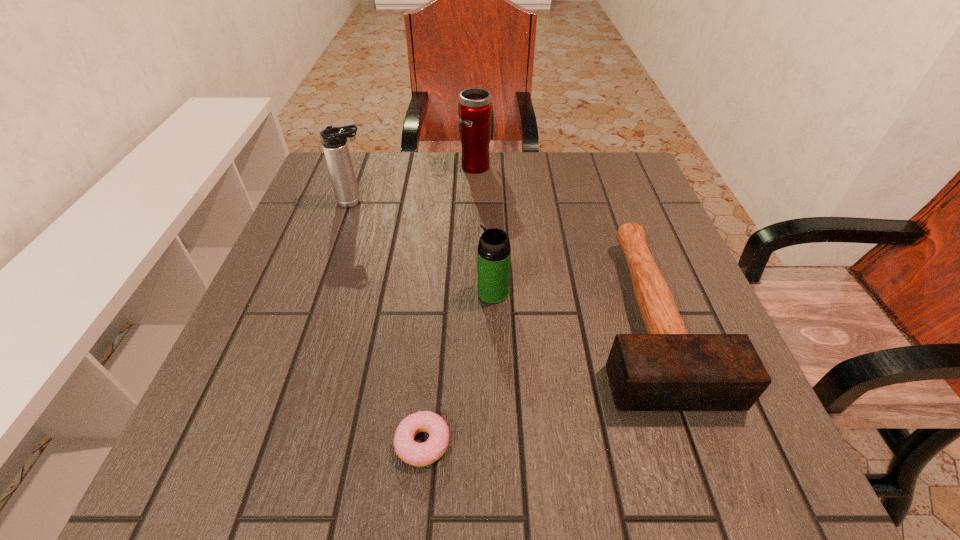
Locate an element on the screen. This screenshot has height=540, width=960. vacant area that lies between the farthest object and the fourth tallest object is located at coordinates (563, 240).

Identify which object is the third closest to the shortest thermos bottle. Please provide its 2D coordinates. Your answer should be formatted as a tuple, i.e. [(x, y)], where the tuple contains the x and y coordinates of a point satisfying the conditions above.

[(334, 140)]

Locate an element on the screen. Image resolution: width=960 pixels, height=540 pixels. the third closest object to the doughnut is located at coordinates click(334, 140).

I want to click on thermos bottle that is the closest one to the farthest object, so click(x=334, y=140).

This screenshot has width=960, height=540. In order to click on the closest thermos bottle to the farthest object in this screenshot , I will do (334, 140).